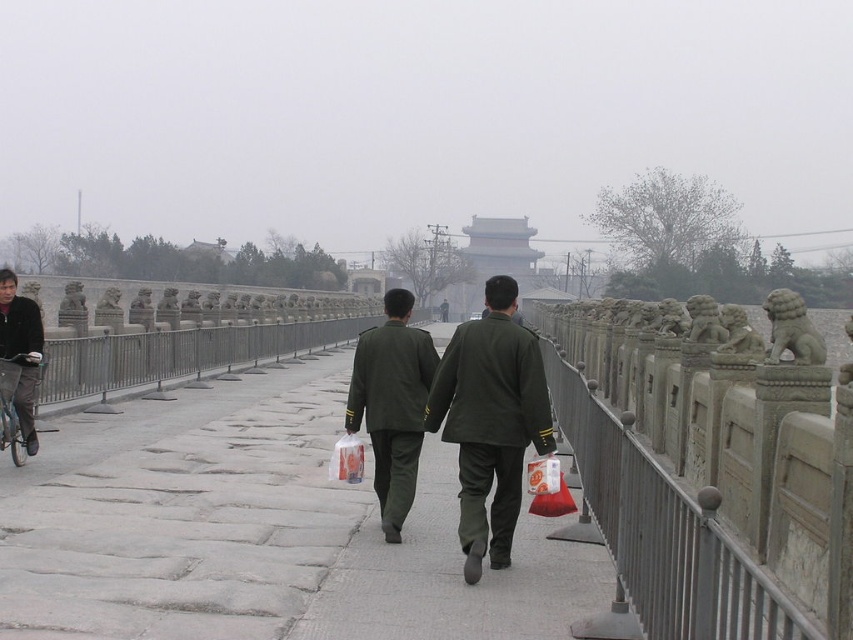
Question: Is gray stone pavement at center positioned before matte green uniform at center?

Choices:
 (A) yes
 (B) no

Answer: (A)

Question: Among these points, which one is nearest to the camera?

Choices:
 (A) tap(389, 348)
 (B) tap(36, 380)

Answer: (A)

Question: Which object appears farthest from the camera in this image?

Choices:
 (A) metallic silver bicycle at left
 (B) matte green uniform at center

Answer: (A)

Question: Is gray stone pavement at center above matte green uniform at center?

Choices:
 (A) yes
 (B) no

Answer: (B)

Question: Can you confirm if gray stone pavement at center is thinner than gray stone railing at right?

Choices:
 (A) no
 (B) yes

Answer: (A)

Question: Which point is farther to the camera?

Choices:
 (A) metallic silver bicycle at left
 (B) green matte uniform at center

Answer: (A)